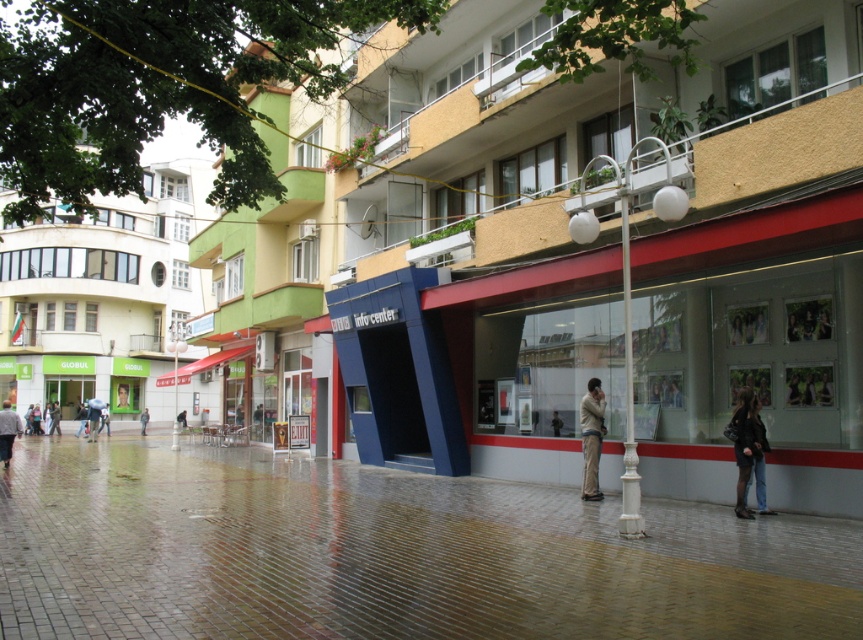
Is point (433, 516) more distant than point (52, 420)?

That is False.

Between brick pavement at lower center and dark gray jacket at center, which one has more height?

With more height is brick pavement at lower center.

You are a GUI agent. You are given a task and a screenshot of the screen. Output one action in this format:
    pyautogui.click(x=<x>, y=<y>)
    Task: Click on the brick pavement at lower center
    Image resolution: width=863 pixels, height=640 pixels.
    Given the screenshot: What is the action you would take?
    pyautogui.click(x=386, y=554)

Does light brown fabric jacket at center have a greater width compared to light blue fabric jacket at center?

In fact, light brown fabric jacket at center might be narrower than light blue fabric jacket at center.

Between light brown fabric jacket at center and light blue fabric jacket at center, which one has less height?

light blue fabric jacket at center is shorter.

Where is `light brown fabric jacket at center`? light brown fabric jacket at center is located at coordinates (591, 436).

You are a GUI agent. You are given a task and a screenshot of the screen. Output one action in this format:
    pyautogui.click(x=<x>, y=<y>)
    Task: Click on the light brown fabric jacket at center
    The height and width of the screenshot is (640, 863).
    Given the screenshot: What is the action you would take?
    pyautogui.click(x=591, y=436)

Does light brown fabric jacket at center have a lesser height compared to dark gray jacket at center?

In fact, light brown fabric jacket at center may be taller than dark gray jacket at center.

Is light brown fabric jacket at center positioned before dark gray jacket at center?

Yes.

Between point (597, 499) and point (58, 413), which one is positioned behind?

The point (58, 413) is more distant.

You are a GUI agent. You are given a task and a screenshot of the screen. Output one action in this format:
    pyautogui.click(x=<x>, y=<y>)
    Task: Click on the light brown fabric jacket at center
    The image size is (863, 640).
    Given the screenshot: What is the action you would take?
    tap(591, 436)